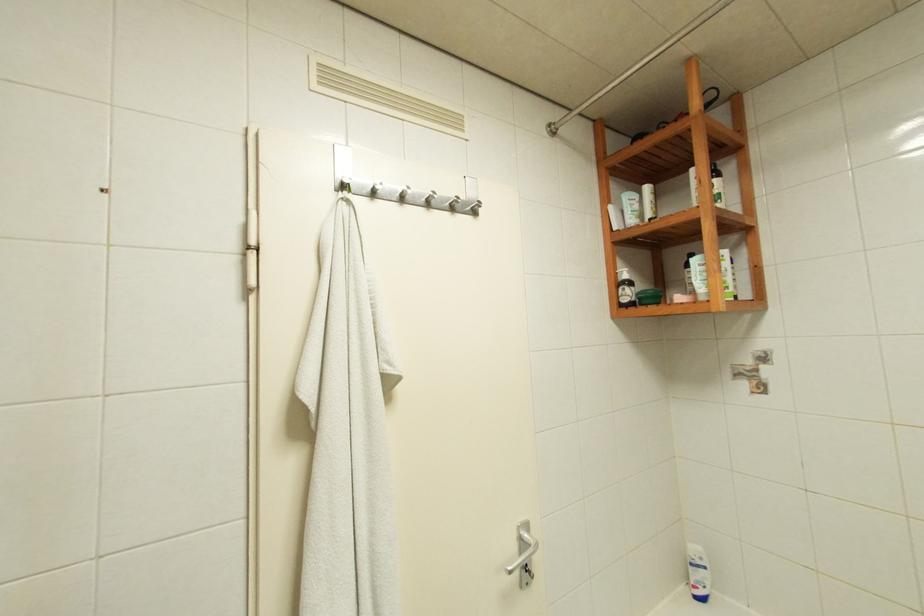
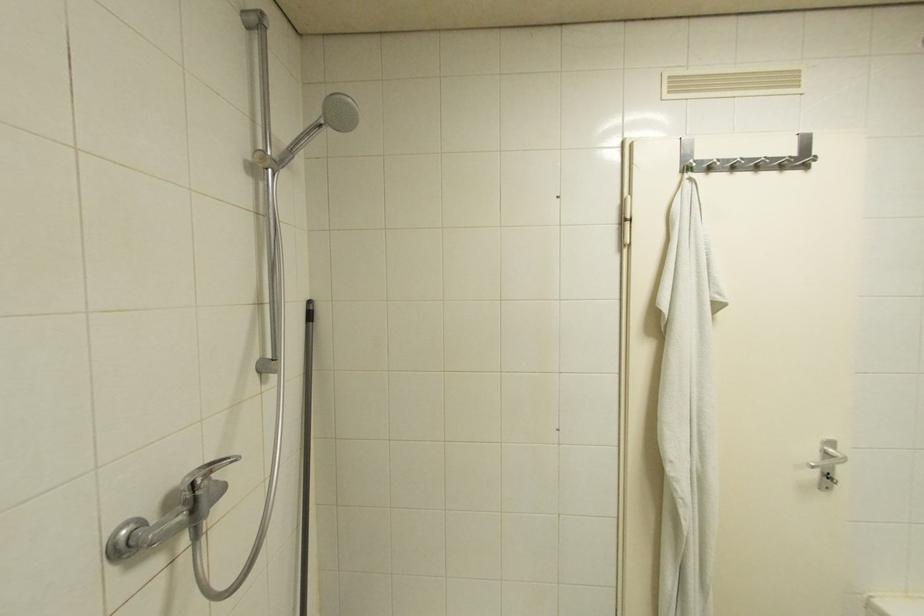
Question: The camera is either moving clockwise (left) or counter-clockwise (right) around the object. The first image is from the beginning of the video and the second image is from the end. Is the camera moving left or right when shooting the video?

Choices:
 (A) Left
 (B) Right

Answer: (B)